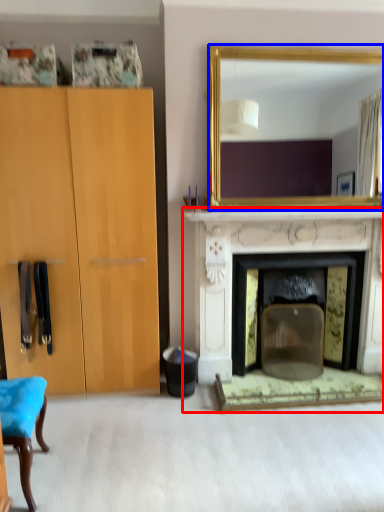
Question: Which object is further to the camera taking this photo, fireplace (highlighted by a red box) or mirror (highlighted by a blue box)?

Choices:
 (A) fireplace
 (B) mirror

Answer: (A)